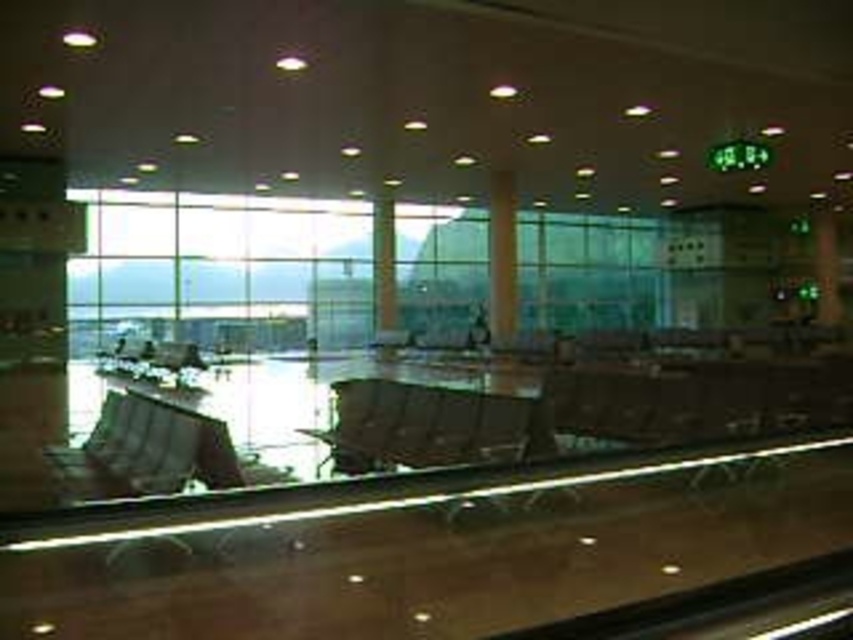
You are a passenger trying to locate the pillars in the airport terminal. According to the scene, which pillar is narrower between the brown wood pillar at center and the green glass pillar at center?

The brown wood pillar at center is narrower than the green glass pillar at center.

You are standing in the airport terminal and want to take a photo of both the conveyor belt and the seating area. You notice two points marked as point (490, 177) and point (393, 230). Which point is closer to your camera lens when you aim to capture both areas in the frame?

Point (490, 177) is closer to the camera than point (393, 230), so it will appear nearer in your photo.